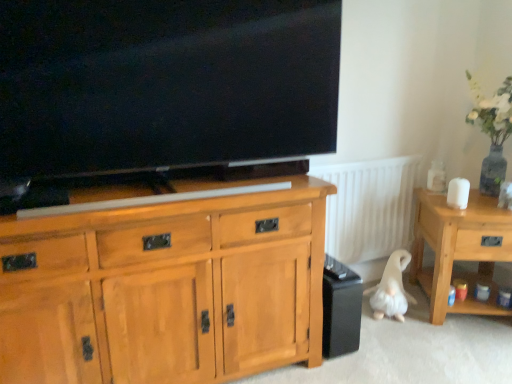
Locate an element on the screen. This screenshot has width=512, height=384. vacant region above light brown wood cabinet at center (from a real-world perspective) is located at coordinates (142, 195).